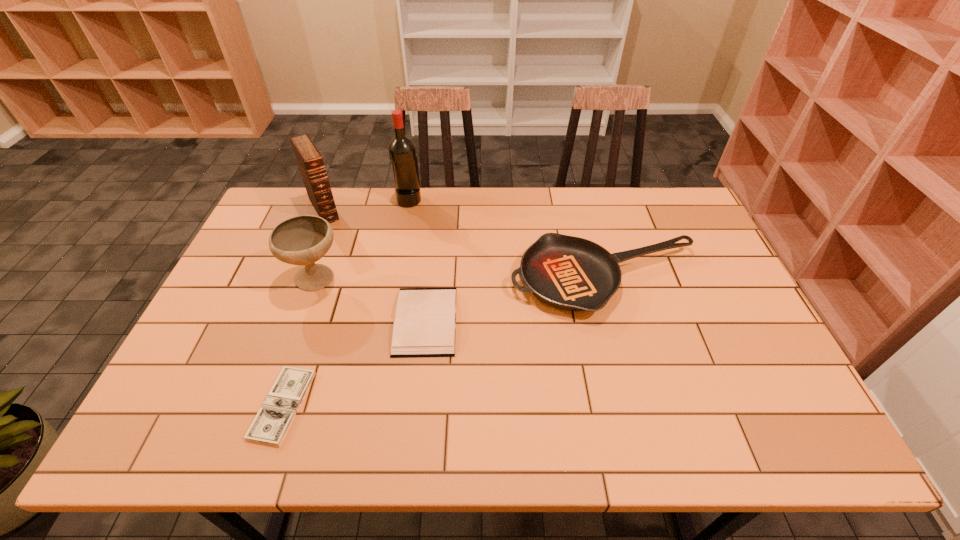
Locate an element on the screen. This screenshot has width=960, height=540. vacant space located 0.280m on the front of the chalice is located at coordinates (277, 391).

Find the location of a particular element. vacant point located 0.130m on the left of the frying pan is located at coordinates (466, 280).

The width and height of the screenshot is (960, 540). What are the coordinates of `free location located on the right of the hardback book` in the screenshot? It's located at (568, 321).

What are the coordinates of `free space located 0.290m on the back of the dollar` in the screenshot? It's located at (324, 283).

I want to click on wine bottle located at the far edge, so 402,152.

I want to click on Bible that is at the far edge, so click(x=309, y=159).

Image resolution: width=960 pixels, height=540 pixels. What are the coordinates of `object at the near edge` in the screenshot? It's located at (270, 425).

Locate an element on the screen. Image resolution: width=960 pixels, height=540 pixels. object that is at the left edge is located at coordinates (309, 159).

Where is `object at the right edge`? object at the right edge is located at coordinates (570, 273).

Where is `object that is at the far left corner`? object that is at the far left corner is located at coordinates (309, 159).